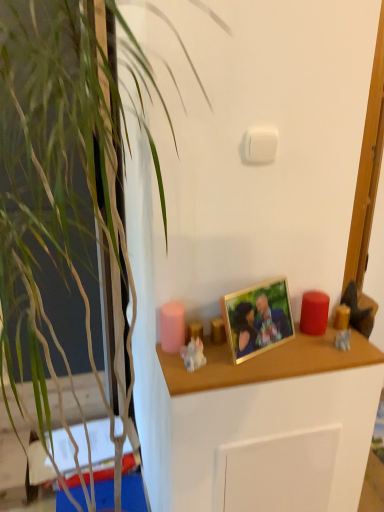
At what (x,y) coordinates should I click in order to perform the action: click on vacant space in wooden shelf at center (from a real-world perspective). Please return your answer as a coordinate pair (x, y). Looking at the image, I should click on (294, 369).